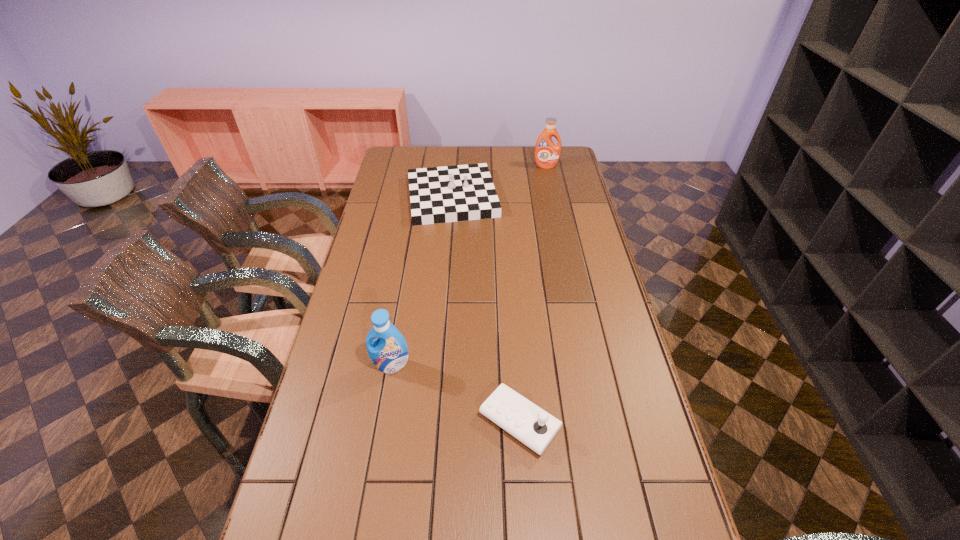
Image resolution: width=960 pixels, height=540 pixels. I want to click on free location located on the back of the nearest object, so click(x=511, y=294).

Identify the location of object that is at the far edge. The width and height of the screenshot is (960, 540). [x=547, y=153].

Identify the location of detergent at the left edge. (389, 353).

At what (x,y) coordinates should I click in order to perform the action: click on checkerboard that is at the left edge. Please return your answer as a coordinate pair (x, y). Image resolution: width=960 pixels, height=540 pixels. Looking at the image, I should click on (446, 194).

Where is `object present at the right edge`? This screenshot has height=540, width=960. object present at the right edge is located at coordinates [x=547, y=153].

Locate an element on the screen. The width and height of the screenshot is (960, 540). object that is at the far right corner is located at coordinates (547, 153).

This screenshot has height=540, width=960. In the image, there is a desktop. Find the location of `vacant space at the far edge`. vacant space at the far edge is located at coordinates (493, 153).

This screenshot has height=540, width=960. In order to click on vacant space at the left edge in this screenshot , I will do `click(330, 352)`.

In the image, there is a desktop. Where is `free space at the right edge`? The width and height of the screenshot is (960, 540). free space at the right edge is located at coordinates (573, 229).

Find the location of `free space between the rightmost object and the shortest object`. free space between the rightmost object and the shortest object is located at coordinates (533, 294).